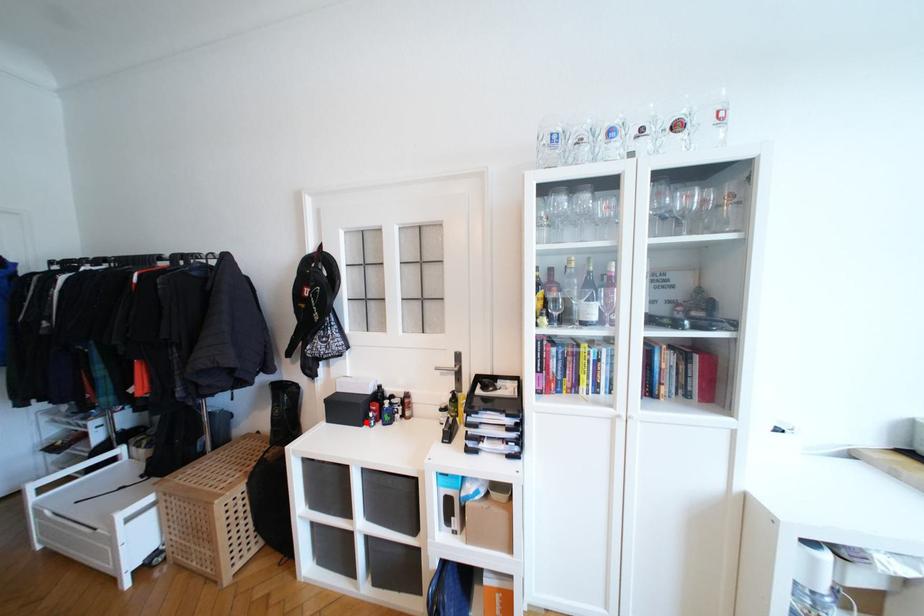
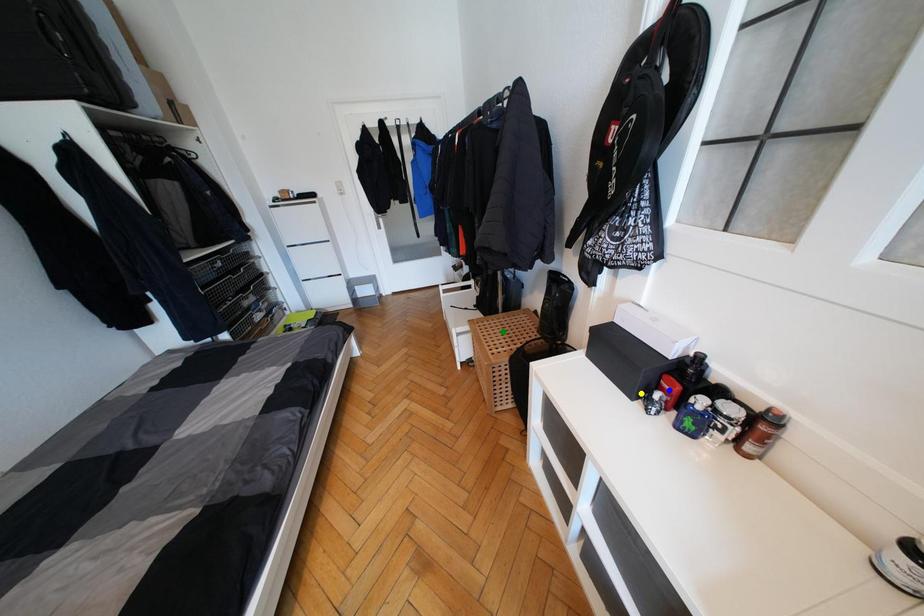
Question: I am providing you with two images of the same scene from different viewpoints. A red point is marked on the first image. You are given multiple points on the second image. Can you choose the point in image 2 that corresponds to the point in image 1?

Choices:
 (A) yellow point
 (B) green point
 (C) blue point

Answer: (A)